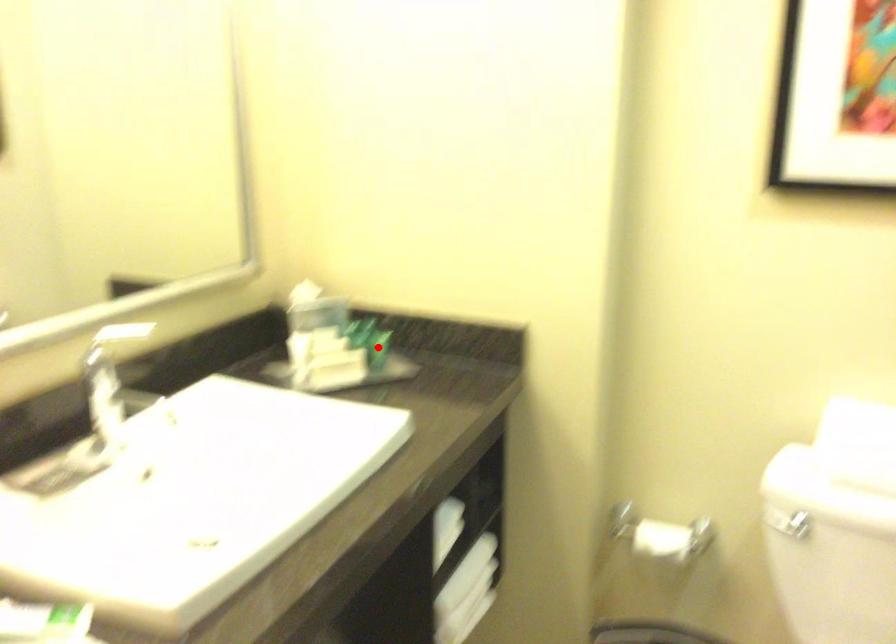
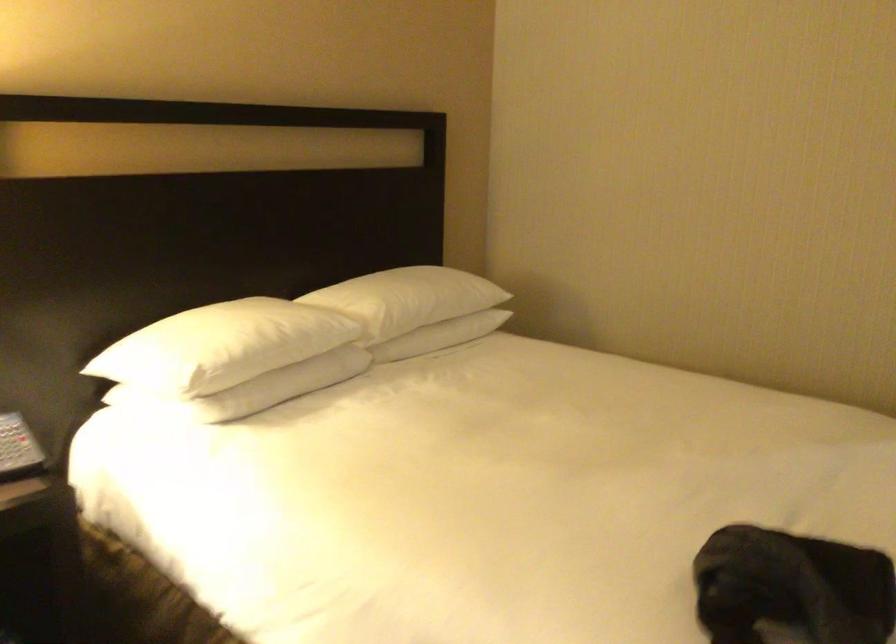
Question: I am providing you with two images of the same scene from different viewpoints. A red point is marked on the first image. At the location where the point appears in image 1, is it still visible in image 2?

Choices:
 (A) Yes
 (B) No

Answer: (B)